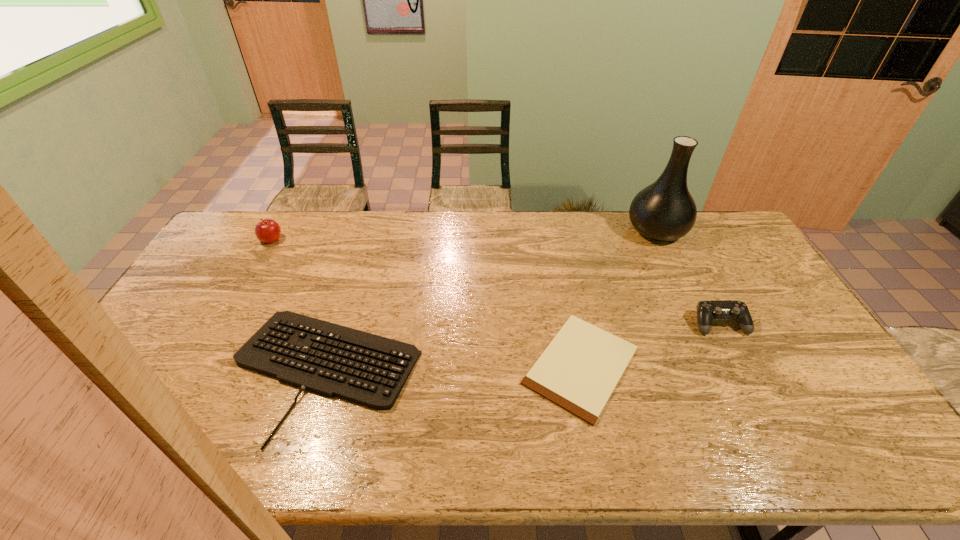
The width and height of the screenshot is (960, 540). I want to click on free location located 0.180m on the front of the third tallest object, so click(755, 390).

Locate an element on the screen. This screenshot has height=540, width=960. free space located on the right of the computer keyboard is located at coordinates coord(504,372).

What are the coordinates of `vacant space located 0.050m on the right of the third object from left to right` in the screenshot? It's located at (661, 366).

Identify the location of vase at the far edge. The image size is (960, 540). (664, 211).

What are the coordinates of `apple that is at the far edge` in the screenshot? It's located at pos(268,231).

The width and height of the screenshot is (960, 540). Identify the location of object located in the near edge section of the desktop. (329, 359).

Find the location of a particular element. Image resolution: width=960 pixels, height=540 pixels. object positioned at the left edge is located at coordinates (268, 231).

This screenshot has height=540, width=960. I want to click on object that is at the far left corner, so click(268, 231).

In the image, there is a desktop. In order to click on vacant space at the near edge in this screenshot , I will do `click(684, 430)`.

The image size is (960, 540). In the image, there is a desktop. Identify the location of blank space at the right edge. (804, 402).